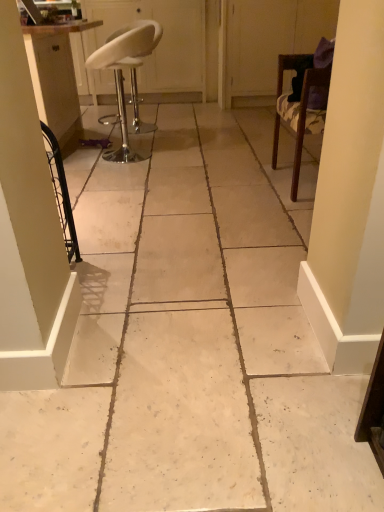
Find the location of a particular element. This screenshot has width=384, height=512. vacant area that is in front of white leather stool at upper left, placed as the 1th chair when sorted from left to right is located at coordinates (99, 178).